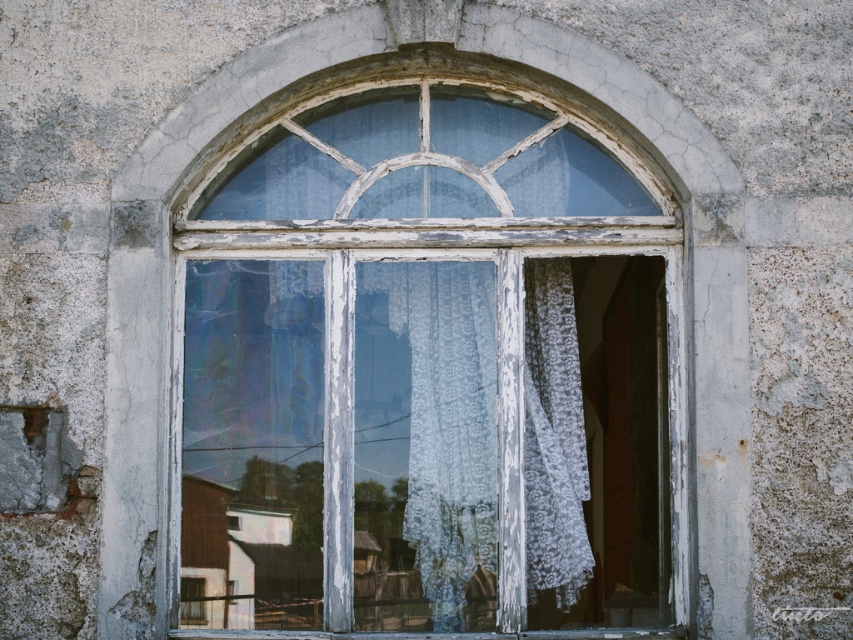
Looking at this image, you are a painter standing 20 feet away from the window. You want to touch up the white peeling paint at center. Can you reach it without moving closer?

The white peeling paint at center is 22.33 feet from the camera, so you are currently 2 feet away from it. Since you can only reach up to 20 feet, you need to move 2.33 feet closer to reach it.

You are an interior designer assessing the window in the image. You notice the white peeling paint at center and the white lace curtain at center. Which object is positioned higher relative to the other?

The white peeling paint at center is located above the white lace curtain at center, so it is positioned higher.

You are standing outside the window and see two points marked on the window glass. The first point is at coordinates point (x=448, y=444) and the second is at point (x=477, y=419). Which point is closer to you?

Point (x=448, y=444) is in front of point (x=477, y=419), so the first point is closer to you.